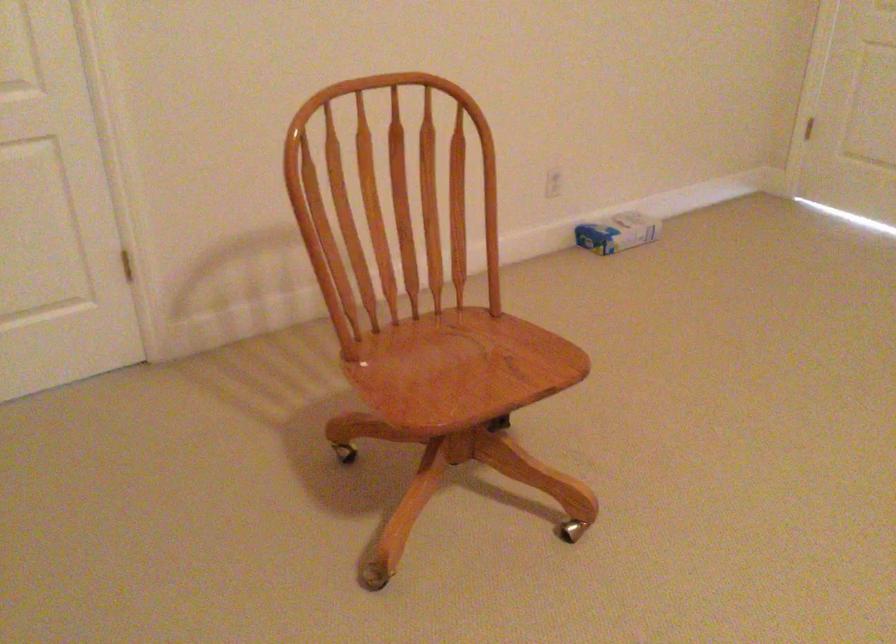
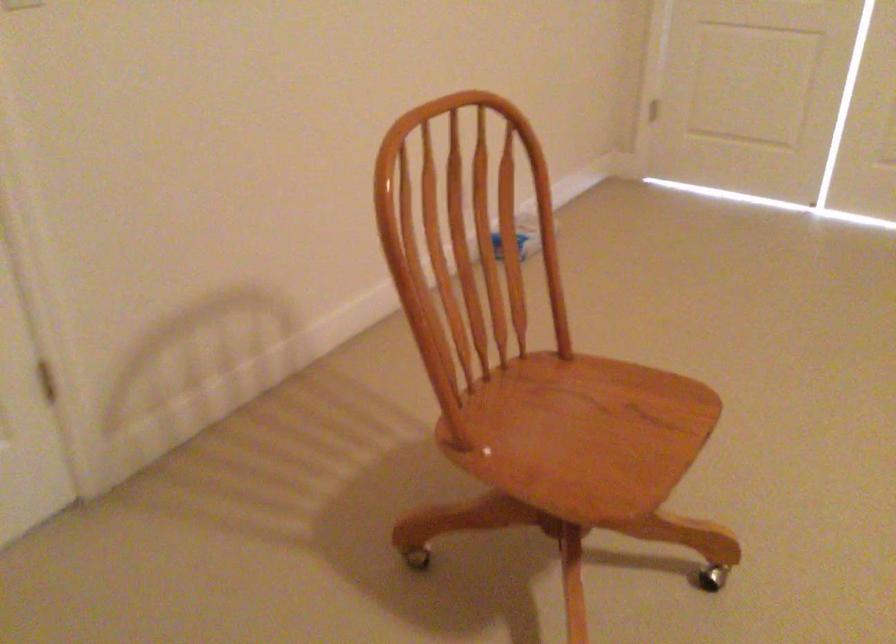
Question: How did the camera likely rotate?

Choices:
 (A) Left
 (B) Right
 (C) Up
 (D) Down

Answer: (B)